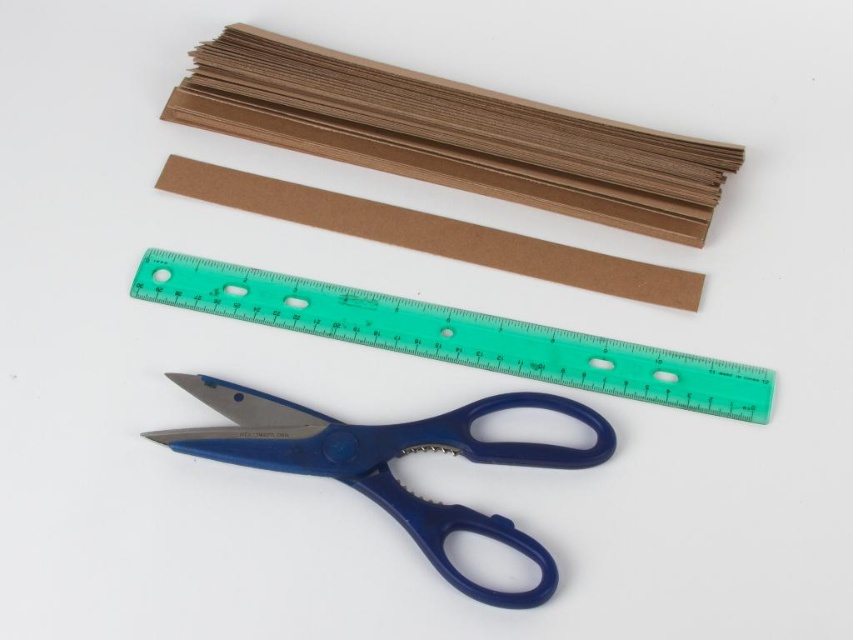
Question: Which object is farther from the camera taking this photo?

Choices:
 (A) brown corrugated cardboard at upper center
 (B) blue plastic scissors at lower center

Answer: (A)

Question: Can you confirm if brown corrugated cardboard at upper center is wider than green plastic ruler at center?

Choices:
 (A) yes
 (B) no

Answer: (B)

Question: Does green plastic ruler at center have a greater width compared to blue plastic scissors at lower center?

Choices:
 (A) yes
 (B) no

Answer: (A)

Question: Based on their relative distances, which object is farther from the green plastic ruler at center?

Choices:
 (A) blue plastic scissors at lower center
 (B) brown corrugated cardboard at upper center

Answer: (B)

Question: Observing the image, what is the correct spatial positioning of green plastic ruler at center in reference to blue plastic scissors at lower center?

Choices:
 (A) below
 (B) above

Answer: (B)

Question: Estimate the real-world distances between objects in this image. Which object is farther from the green plastic ruler at center?

Choices:
 (A) blue plastic scissors at lower center
 (B) brown corrugated cardboard at upper center

Answer: (B)